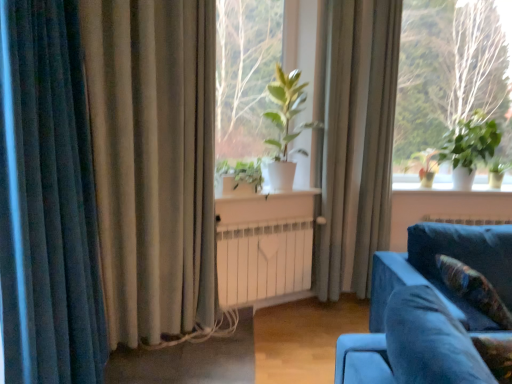
Image resolution: width=512 pixels, height=384 pixels. I want to click on vacant region under silky beige curtain at center, the 3th curtain when ordered from front to back (from a real-world perspective), so click(324, 304).